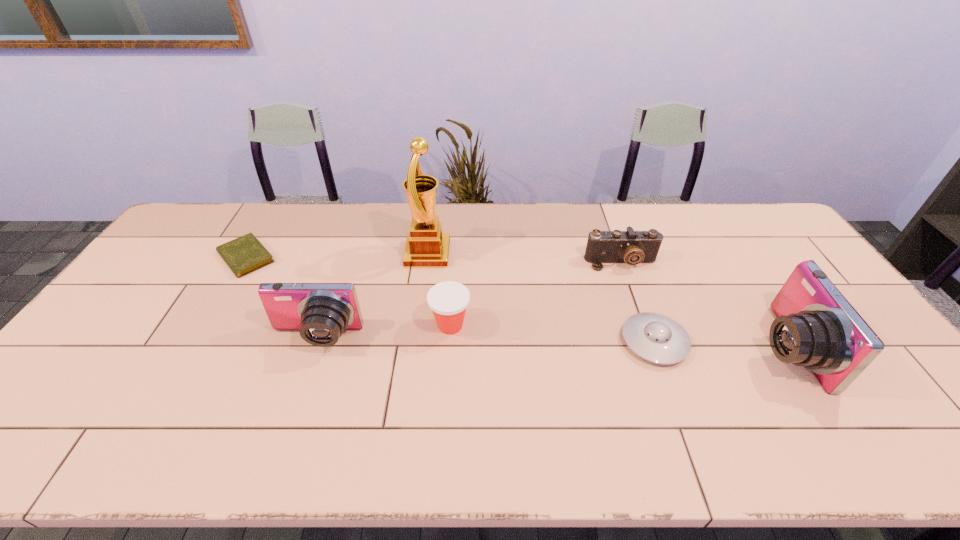
Locate an element on the screen. Image resolution: width=960 pixels, height=540 pixels. saucer is located at coordinates (654, 337).

Image resolution: width=960 pixels, height=540 pixels. I want to click on vacant space located 0.160m on the front-facing side of the sixth object from right to left, so click(x=290, y=412).

In order to click on free space located 0.240m on the front-facing side of the sixth shortest object in this screenshot , I will do `click(665, 347)`.

You are a GUI agent. You are given a task and a screenshot of the screen. Output one action in this format:
    pyautogui.click(x=<x>, y=<y>)
    Task: Click on the vacant space located on the front-facing side of the sixth shortest object
    
    Given the screenshot: What is the action you would take?
    pyautogui.click(x=636, y=347)

Find the location of a particular element. The height and width of the screenshot is (540, 960). vacant space located on the front-facing side of the sixth shortest object is located at coordinates (624, 347).

The image size is (960, 540). Find the location of `free space located 0.100m on the right of the shortest object`. free space located 0.100m on the right of the shortest object is located at coordinates (308, 257).

Image resolution: width=960 pixels, height=540 pixels. I want to click on free space located 0.220m on the front-facing side of the shortest camera, so click(x=643, y=325).

Where is `vacant space situated on the front-facing side of the tallest object`? This screenshot has width=960, height=540. vacant space situated on the front-facing side of the tallest object is located at coordinates (546, 254).

This screenshot has width=960, height=540. Identify the location of free spot located 0.300m on the back of the Dixie cup. (455, 245).

Find the location of `vacant region located 0.400m on the right of the second shortest object`. vacant region located 0.400m on the right of the second shortest object is located at coordinates (835, 342).